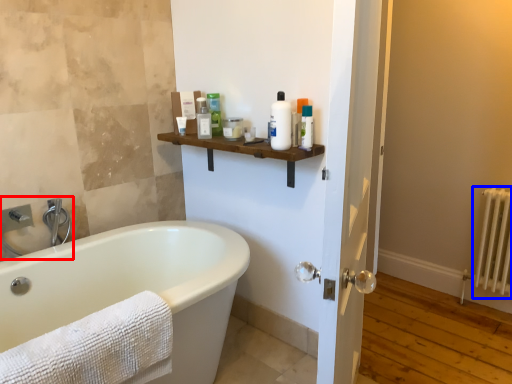
Question: Which object appears farthest to the camera in this image, sink (highlighted by a red box) or radiator (highlighted by a blue box)?

Choices:
 (A) sink
 (B) radiator

Answer: (B)